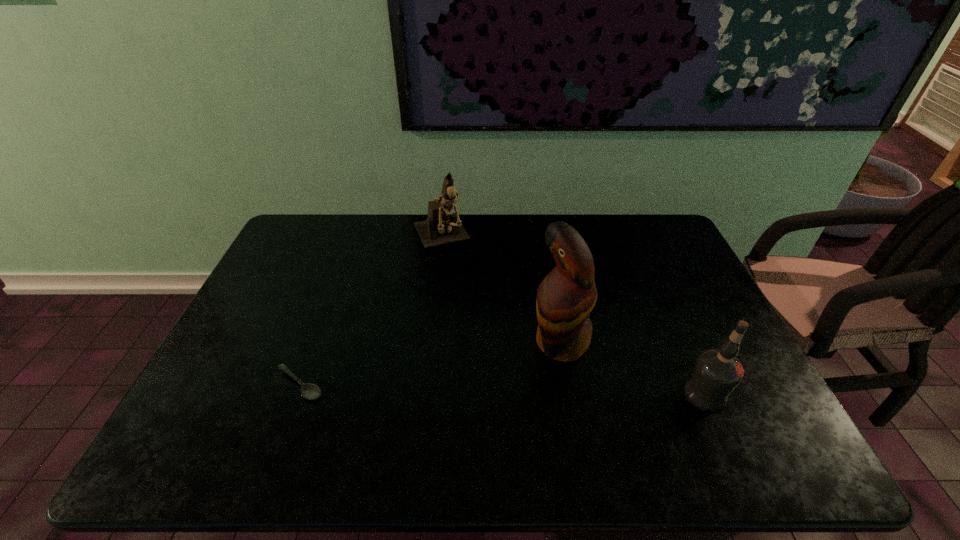
The image size is (960, 540). In order to click on blank area at the far edge in this screenshot , I will do `click(334, 245)`.

Locate an element on the screen. The image size is (960, 540). vacant space at the near edge is located at coordinates (537, 401).

The width and height of the screenshot is (960, 540). In the image, there is a desktop. Find the location of `blank space at the right edge`. blank space at the right edge is located at coordinates (748, 386).

Find the location of a particular element. vacant space at the far left corner of the desktop is located at coordinates (292, 244).

In the image, there is a desktop. Where is `vacant region at the far right corner`? This screenshot has width=960, height=540. vacant region at the far right corner is located at coordinates (660, 230).

Locate an element on the screen. The image size is (960, 540). vacant space in between the tallest object and the vodka is located at coordinates (633, 368).

What are the coordinates of `free space between the third object from right to left and the shortest object` in the screenshot? It's located at (371, 311).

This screenshot has height=540, width=960. Find the location of `free spot between the shortest object and the third object from left to right`. free spot between the shortest object and the third object from left to right is located at coordinates (430, 363).

Identify the location of unoccupied position between the parrot and the vodka. (633, 368).

Image resolution: width=960 pixels, height=540 pixels. Find the location of `free space between the second tallest object and the parrot`. free space between the second tallest object and the parrot is located at coordinates (501, 290).